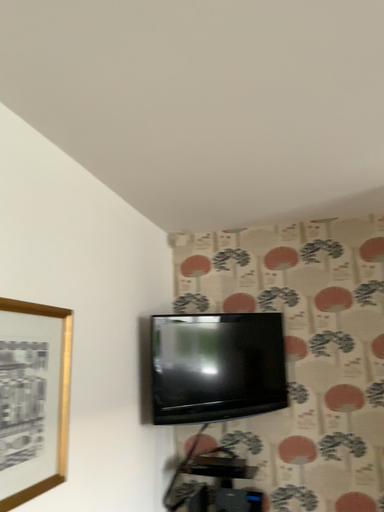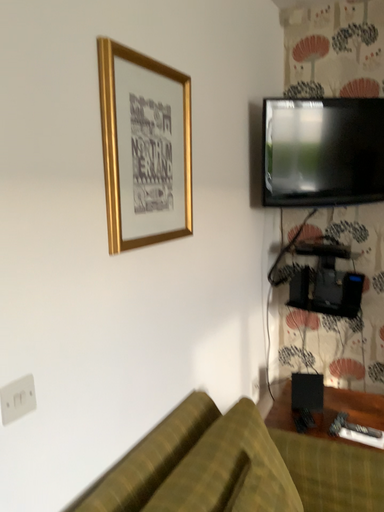
Question: How did the camera likely rotate when shooting the video?

Choices:
 (A) rotated right
 (B) rotated left

Answer: (B)